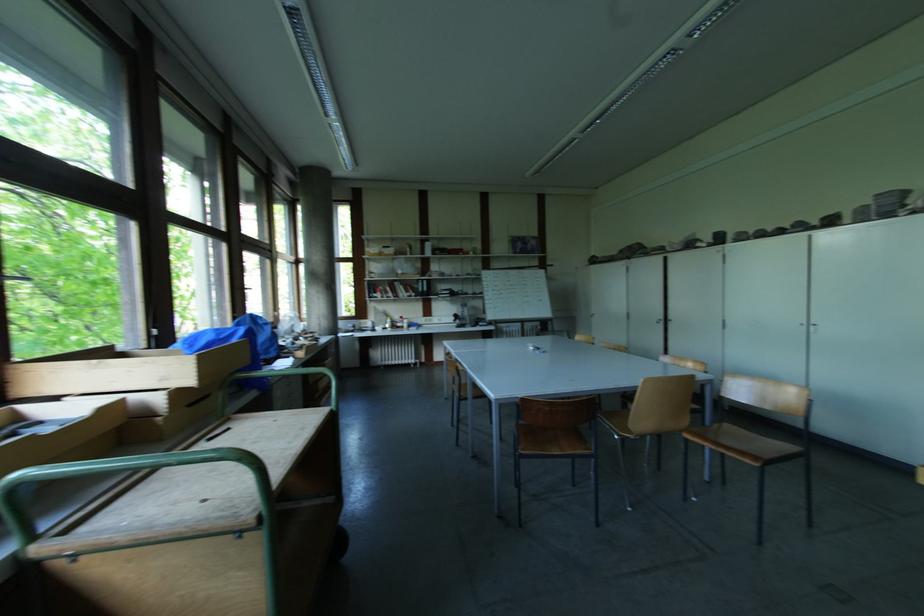
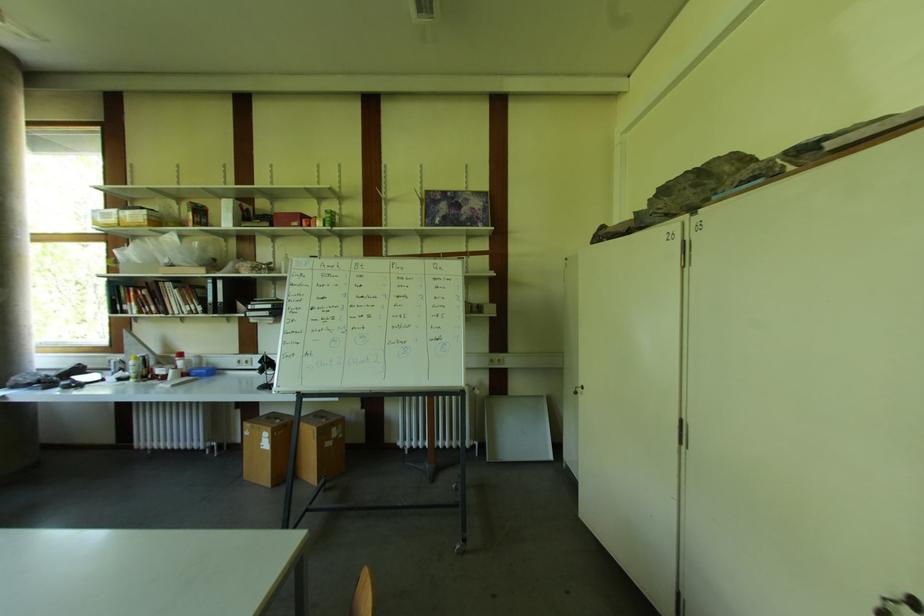
Find the pixel in the second image that matches the point at 411,254 in the first image.

(193, 225)